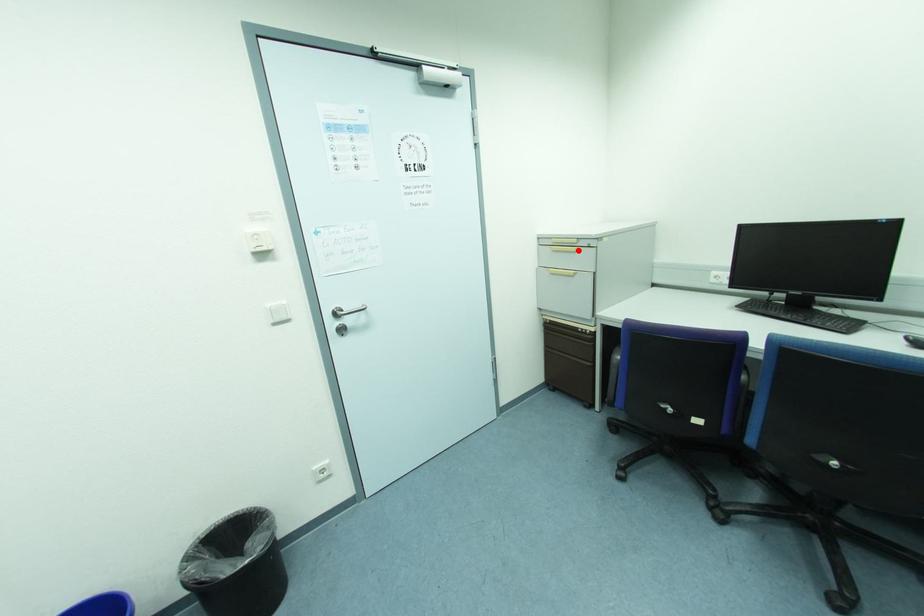
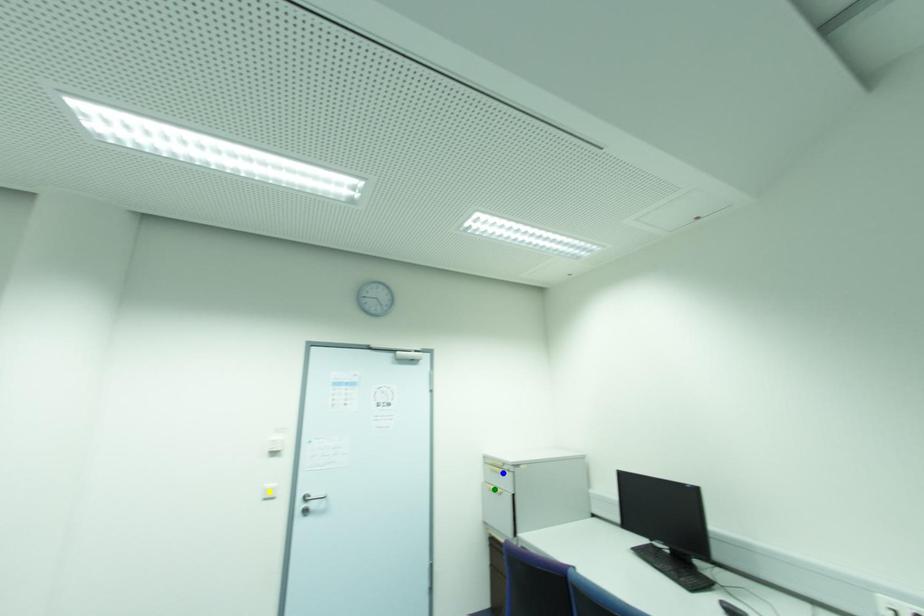
Question: I am providing you with two images of the same scene from different viewpoints. A red point is marked on the first image. You are given multiple points on the second image. Which spot in image 2 lines up with the point in image 1?

Choices:
 (A) blue point
 (B) yellow point
 (C) green point

Answer: (A)